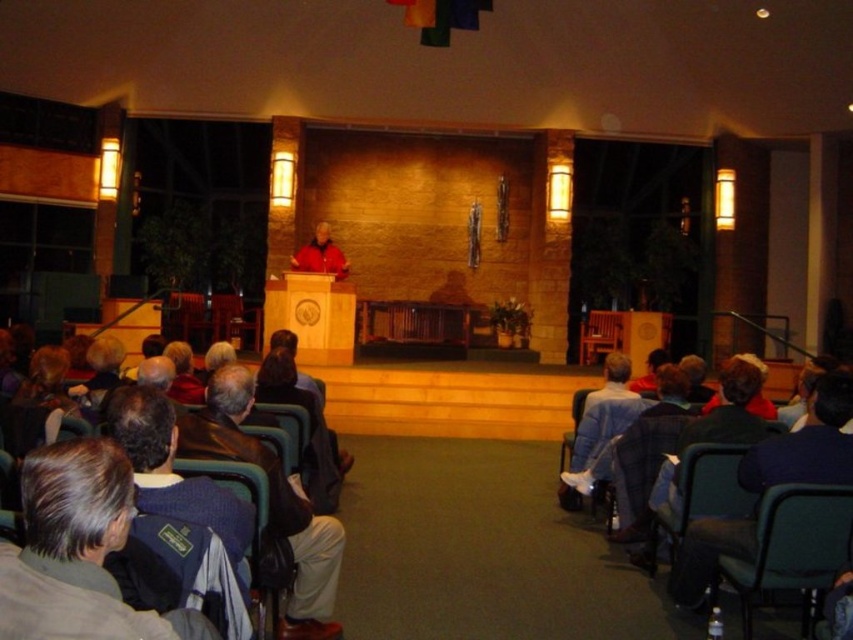
Is blue denim jacket at lower right thinner than matte black chair at center?

Correct, blue denim jacket at lower right's width is less than matte black chair at center's.

The height and width of the screenshot is (640, 853). What do you see at coordinates (599, 426) in the screenshot? I see `blue denim jacket at lower right` at bounding box center [599, 426].

Which is in front, point (595, 433) or point (180, 312)?

Point (595, 433) is more forward.

Where is `blue denim jacket at lower right`? The height and width of the screenshot is (640, 853). blue denim jacket at lower right is located at coordinates (599, 426).

Does blue denim jacket at lower right have a lesser width compared to dark blue fabric chair at lower left?

In fact, blue denim jacket at lower right might be wider than dark blue fabric chair at lower left.

Between point (596, 440) and point (288, 561), which one is positioned in front?

Positioned in front is point (288, 561).

Does point (585, 396) come behind point (262, 493)?

Yes, it is.

At what (x,y) coordinates should I click in order to perform the action: click on blue denim jacket at lower right. Please return your answer as a coordinate pair (x, y). The width and height of the screenshot is (853, 640). Looking at the image, I should click on (599, 426).

Who is positioned more to the left, dark blue sweater at center or matte black chair at center?

matte black chair at center is more to the left.

Identify the location of dark blue sweater at center. (271, 506).

Find the location of a particular element. The width and height of the screenshot is (853, 640). dark blue sweater at center is located at coordinates (271, 506).

I want to click on dark blue sweater at center, so click(271, 506).